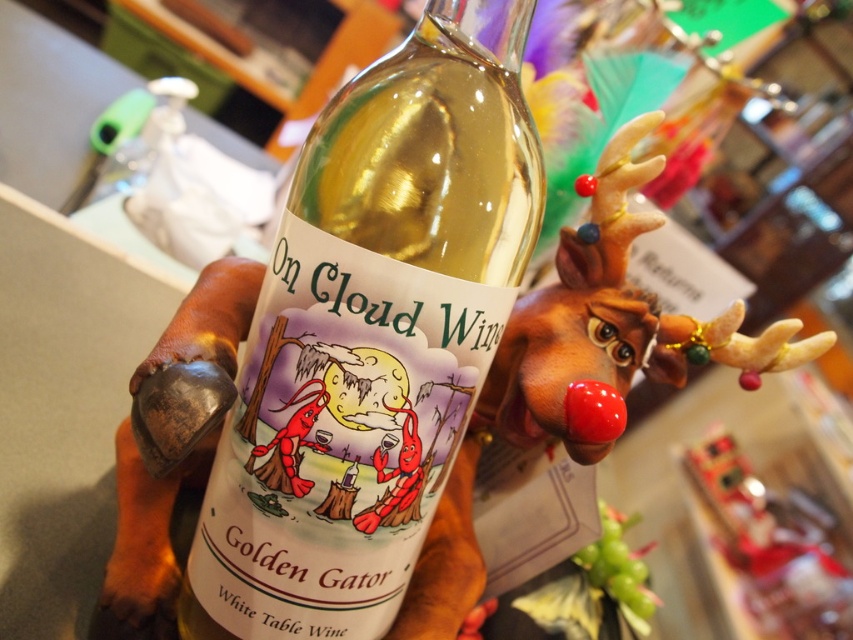
You are designing a display for a holiday gift shop and need to arrange the translucent glass bottle at center and the brown rubber reindeer at center on a shelf. If the shelf has limited width, which item should you place first to ensure both fit side by side?

The translucent glass bottle at center is thinner than the brown rubber reindeer at center, so you should place the brown rubber reindeer at center first to leave enough space for the thinner bottle next to it.

You are a delivery person who needs to pack the translucent glass bottle at center and the brown rubber reindeer at center into a box. The box can only accommodate items where the taller item is no more than 10 cm taller than the shorter one. Do you think both items can fit together in the box?

The translucent glass bottle at center is taller than the brown rubber reindeer at center. Since the box requires the taller item to be no more than 10 cm taller than the shorter one, but the exact height difference isn